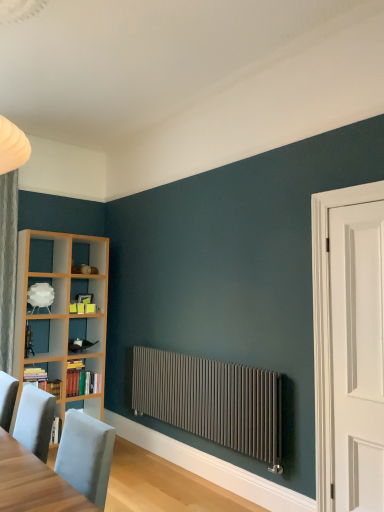
What do you see at coordinates (42, 380) in the screenshot? I see `hardcover book at left, which is the first book from front to back` at bounding box center [42, 380].

Where is `light gray wood table at lower left`? light gray wood table at lower left is located at coordinates (33, 483).

Locate an element on the screen. The image size is (384, 512). white matte door at right is located at coordinates (357, 354).

At what (x,y) coordinates should I click in order to perform the action: click on hardcover book at left, acting as the 2th book starting from the back. Please return your answer as a coordinate pair (x, y). This screenshot has width=384, height=512. Looking at the image, I should click on (42, 380).

Is point (69, 390) less distant than point (264, 382)?

No, it is not.

Does hardcover books at left, which is the 1th book in back-to-front order, touch matte gray radiator at center?

hardcover books at left, which is the 1th book in back-to-front order, and matte gray radiator at center are not in contact.

Between hardcover books at left, acting as the second book starting from the front, and matte gray radiator at center, which one appears on the right side from the viewer's perspective?

Positioned to the right is matte gray radiator at center.

In the scene shown: From the image's perspective, which one is positioned lower, hardcover books at left, which is the 1th book in back-to-front order, or matte gray radiator at center?

hardcover books at left, which is the 1th book in back-to-front order, from the image's perspective.

Is hardcover books at left, acting as the second book starting from the front, in front of light gray wood table at lower left?

No.

How much distance is there between hardcover books at left, acting as the second book starting from the front, and light gray wood table at lower left?

hardcover books at left, acting as the second book starting from the front, and light gray wood table at lower left are 2.57 meters apart from each other.

Is hardcover books at left, acting as the second book starting from the front, wider than light gray wood table at lower left?

No, hardcover books at left, acting as the second book starting from the front, is not wider than light gray wood table at lower left.

Is hardcover books at left, which is the 1th book in back-to-front order, placed right next to light gray wood table at lower left?

hardcover books at left, which is the 1th book in back-to-front order, is not next to light gray wood table at lower left, and they're not touching.

From the image's perspective, does hardcover book at left, which is the first book from front to back, appear higher than hardcover books at left, which is the 1th book in back-to-front order?

Yes, from the image's perspective, hardcover book at left, which is the first book from front to back, is over hardcover books at left, which is the 1th book in back-to-front order.

Between hardcover book at left, acting as the 2th book starting from the back, and hardcover books at left, which is the 1th book in back-to-front order, which one has larger width?

Wider between the two is hardcover books at left, which is the 1th book in back-to-front order.

The width and height of the screenshot is (384, 512). Find the location of `book on the right of hardcover book at left, which is the first book from front to back`. book on the right of hardcover book at left, which is the first book from front to back is located at coordinates (81, 380).

Can we say white matte lampshade at left lies outside hardcover books at left, acting as the second book starting from the front?

white matte lampshade at left lies outside hardcover books at left, acting as the second book starting from the front,'s area.

From a real-world perspective, is white matte lampshade at left on hardcover books at left, which is the 1th book in back-to-front order?

Yes.

Based on the photo, between white matte lampshade at left and hardcover books at left, which is the 1th book in back-to-front order, which one has larger width?

Wider between the two is hardcover books at left, which is the 1th book in back-to-front order.

From the image's perspective, count 2nd books downward from the white matte lampshade at left and point to it. Please provide its 2D coordinates.

[(81, 380)]

Between hardcover book at left, which is the first book from front to back, and light gray fabric chair at lower left, which one has less height?

With less height is hardcover book at left, which is the first book from front to back.

How different are the orientations of hardcover book at left, acting as the 2th book starting from the back, and light gray fabric chair at lower left in degrees?

The angular difference between hardcover book at left, acting as the 2th book starting from the back, and light gray fabric chair at lower left is 90.4 degrees.

Based on the photo, which object is closer to the camera, hardcover book at left, which is the first book from front to back, or light gray fabric chair at lower left?

light gray fabric chair at lower left.

In the scene shown: Is hardcover book at left, which is the first book from front to back, smaller than light gray fabric chair at lower left?

Correct, hardcover book at left, which is the first book from front to back, occupies less space than light gray fabric chair at lower left.

Is hardcover book at left, acting as the 2th book starting from the back, looking in the opposite direction of matte gray radiator at center?

That's not correct — hardcover book at left, acting as the 2th book starting from the back, is not looking away from matte gray radiator at center.

From the image's perspective, who appears lower, hardcover book at left, which is the first book from front to back, or matte gray radiator at center?

From the image's view, hardcover book at left, which is the first book from front to back, is below.

Is hardcover book at left, which is the first book from front to back, taller than matte gray radiator at center?

Incorrect, the height of hardcover book at left, which is the first book from front to back, is not larger of that of matte gray radiator at center.

Can matte gray radiator at center be found inside hardcover book at left, acting as the 2th book starting from the back?

No, matte gray radiator at center is not a part of hardcover book at left, acting as the 2th book starting from the back.

Is light gray fabric chair at lower left located outside light gray wood table at lower left?

Yes, light gray fabric chair at lower left is not within light gray wood table at lower left.

From their relative heights in the image, would you say light gray fabric chair at lower left is taller or shorter than light gray wood table at lower left?

In the image, light gray fabric chair at lower left appears to be shorter than light gray wood table at lower left.

From the picture: Considering the sizes of objects light gray fabric chair at lower left and light gray wood table at lower left in the image provided, who is wider, light gray fabric chair at lower left or light gray wood table at lower left?

light gray wood table at lower left is wider.

Is light gray fabric chair at lower left positioned far away from light gray wood table at lower left?

No, light gray fabric chair at lower left is in close proximity to light gray wood table at lower left.

From the matte gray radiator at center, count 2nd books backward and point to it. Please provide its 2D coordinates.

[(81, 380)]

Identify the location of book that is the 1st object to the left of the light gray wood table at lower left, starting at the anchor. (81, 380).

When comparing their distances from matte gray radiator at center, does white matte door at right or hardcover books at left, which is the 1th book in back-to-front order, seem closer?

Based on the image, white matte door at right appears to be nearer to matte gray radiator at center.

Looking at the image, which one is located closer to hardcover books at left, which is the 1th book in back-to-front order, white matte door at right or light gray wood table at lower left?

light gray wood table at lower left.

Considering their positions, is white matte lampshade at left positioned closer to hardcover books at left, which is the 1th book in back-to-front order, than matte gray radiator at center?

Based on the image, white matte lampshade at left appears to be nearer to hardcover books at left, which is the 1th book in back-to-front order.

When comparing their distances from light gray wood table at lower left, does light gray fabric chair at lower left or hardcover books at left, which is the 1th book in back-to-front order, seem closer?

The object closer to light gray wood table at lower left is light gray fabric chair at lower left.

Looking at this image, looking at the image, which one is located further to white matte door at right, white matte lampshade at left or matte gray radiator at center?

Based on the image, white matte lampshade at left appears to be further to white matte door at right.

Looking at the image, which one is located further to hardcover book at left, which is the first book from front to back, matte gray radiator at center or white matte lampshade at left?

Among the two, matte gray radiator at center is located further to hardcover book at left, which is the first book from front to back.

From the image, which object appears to be farther from light gray fabric chair at lower left, white matte lampshade at left or light gray wood table at lower left?

white matte lampshade at left is positioned further to the anchor light gray fabric chair at lower left.

When comparing their distances from hardcover book at left, acting as the 2th book starting from the back, does white matte lampshade at left or light gray fabric chair at lower left seem closer?

white matte lampshade at left is closer to hardcover book at left, acting as the 2th book starting from the back.

You are a GUI agent. You are given a task and a screenshot of the screen. Output one action in this format:
    pyautogui.click(x=<x>, y=<y>)
    Task: Click on the radiator between light gray wood table at lower left and white matte door at right in the horizontal direction
    This screenshot has height=512, width=384.
    Given the screenshot: What is the action you would take?
    pyautogui.click(x=212, y=401)

The image size is (384, 512). Find the location of `radiator between light gray wood table at lower left and white matte lampshade at left in the front-back direction`. radiator between light gray wood table at lower left and white matte lampshade at left in the front-back direction is located at coordinates (212, 401).

At what (x,y) coordinates should I click in order to perform the action: click on chair between light gray wood table at lower left and matte gray radiator at center from front to back. Please return your answer as a coordinate pair (x, y). Looking at the image, I should click on (35, 420).

Find the location of a particular element. The height and width of the screenshot is (512, 384). radiator between light gray fabric chair at lower left and white matte door at right from left to right is located at coordinates (212, 401).